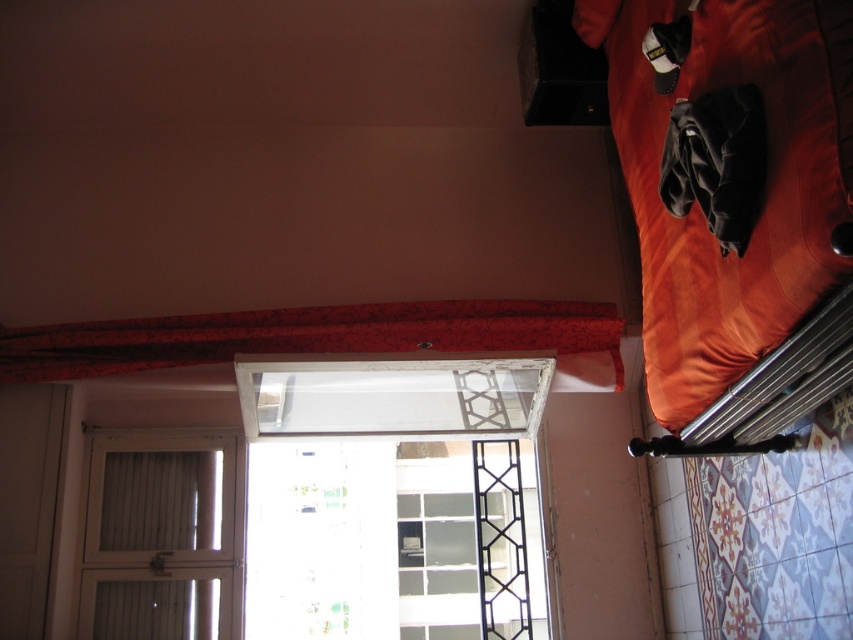
Can you confirm if orange leather bed at right is smaller than red floral fabric curtain at upper center?

No, orange leather bed at right is not smaller than red floral fabric curtain at upper center.

The image size is (853, 640). Find the location of `orange leather bed at right`. orange leather bed at right is located at coordinates (735, 204).

Can you confirm if red floral fabric curtain at upper center is positioned to the right of white wood glass door at lower left?

Correct, you'll find red floral fabric curtain at upper center to the right of white wood glass door at lower left.

In the scene shown: Can you confirm if red floral fabric curtain at upper center is thinner than white wood glass door at lower left?

No, red floral fabric curtain at upper center is not thinner than white wood glass door at lower left.

Is point (463, 314) in front of point (120, 488)?

Yes, it is.

Find the location of a particular element. red floral fabric curtain at upper center is located at coordinates (321, 337).

Does clear glass window at center come in front of red floral fabric curtain at upper center?

No, it is not.

Does clear glass window at center lie behind red floral fabric curtain at upper center?

Yes, clear glass window at center is behind red floral fabric curtain at upper center.

Find the location of a particular element. The width and height of the screenshot is (853, 640). clear glass window at center is located at coordinates (392, 497).